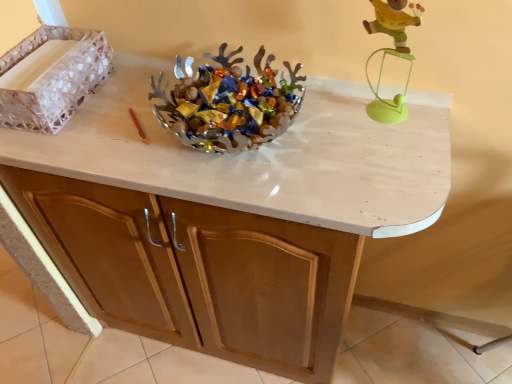
The image size is (512, 384). Identify the location of vacant space to the right of white textured tray at left. (123, 96).